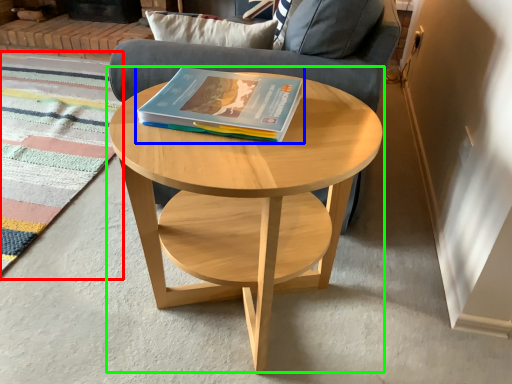
Question: Considering the real-world distances, which object is closest to mat (highlighted by a red box)? book (highlighted by a blue box) or coffee table (highlighted by a green box).

Choices:
 (A) book
 (B) coffee table

Answer: (B)